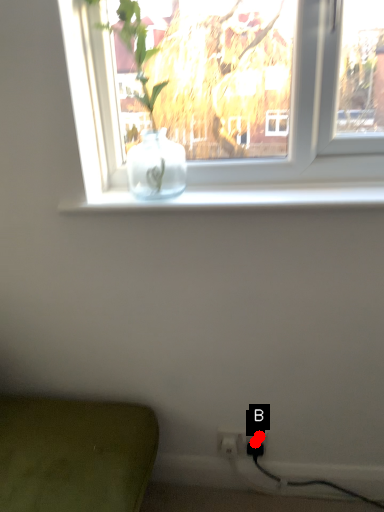
Question: Two points are circled on the image, labeled by A and B beside each circle. Which of the following is the farthest from the observer?

Choices:
 (A) A is further
 (B) B is further

Answer: (A)